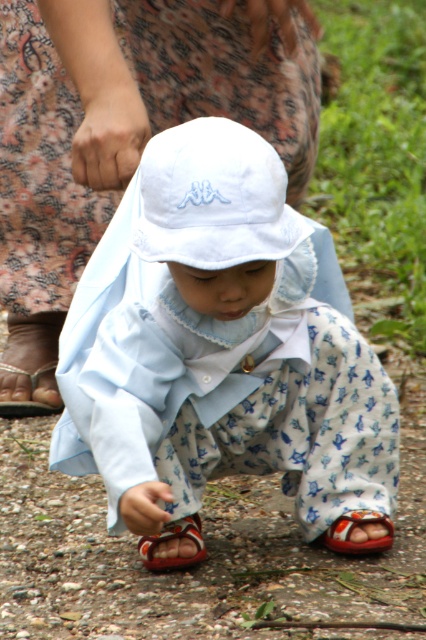
You are a photographer trying to capture the child in the scene. If you want to focus on the white fabric hat at center without the red leather sandal at lower right appearing in the foreground, should you adjust your camera angle upwards or downwards?

The white fabric hat at center is above the red leather sandal at lower right, so to avoid the sandal appearing in the foreground, you should adjust your camera angle upwards to focus on the hat.

Based on the scene description, which object is taller between the white fabric hat at center and the red leather sandal at lower right?

The white fabric hat at center is taller than the red leather sandal at lower right according to the description.